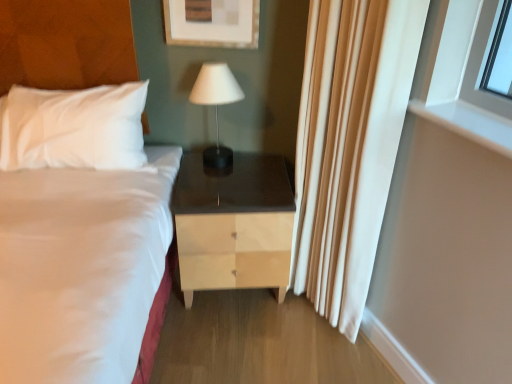
Question: Does white silky curtain at right have a greater height compared to white glossy window at upper right?

Choices:
 (A) no
 (B) yes

Answer: (B)

Question: Can you confirm if white silky curtain at right is shorter than white glossy window at upper right?

Choices:
 (A) no
 (B) yes

Answer: (A)

Question: Can you confirm if white silky curtain at right is thinner than white glossy window at upper right?

Choices:
 (A) yes
 (B) no

Answer: (B)

Question: Is white silky curtain at right wider than white glossy window at upper right?

Choices:
 (A) no
 (B) yes

Answer: (B)

Question: Are white silky curtain at right and white glossy window at upper right making contact?

Choices:
 (A) yes
 (B) no

Answer: (B)

Question: Does point (435, 79) appear closer or farther from the camera than point (210, 72)?

Choices:
 (A) closer
 (B) farther

Answer: (A)

Question: Is white glossy window at upper right inside the boundaries of white matte table lamp at center, or outside?

Choices:
 (A) inside
 (B) outside

Answer: (B)

Question: Is white glossy window at upper right wider or thinner than white matte table lamp at center?

Choices:
 (A) thin
 (B) wide

Answer: (A)

Question: Based on their sizes in the image, would you say white glossy window at upper right is bigger or smaller than white matte table lamp at center?

Choices:
 (A) small
 (B) big

Answer: (A)

Question: From the image's perspective, is white silky curtain at right located above or below white glossy window at upper right?

Choices:
 (A) below
 (B) above

Answer: (A)

Question: In terms of height, does white silky curtain at right look taller or shorter compared to white glossy window at upper right?

Choices:
 (A) tall
 (B) short

Answer: (A)

Question: Based on their positions, is white silky curtain at right located to the left or right of white glossy window at upper right?

Choices:
 (A) right
 (B) left

Answer: (B)

Question: Looking at their shapes, would you say white silky curtain at right is wider or thinner than white glossy window at upper right?

Choices:
 (A) thin
 (B) wide

Answer: (B)

Question: From the image's perspective, relative to light wood/finish nightstand at center, is white matte table lamp at center above or below?

Choices:
 (A) above
 (B) below

Answer: (A)

Question: Is point click(x=206, y=82) positioned closer to the camera than point click(x=237, y=284)?

Choices:
 (A) closer
 (B) farther

Answer: (A)